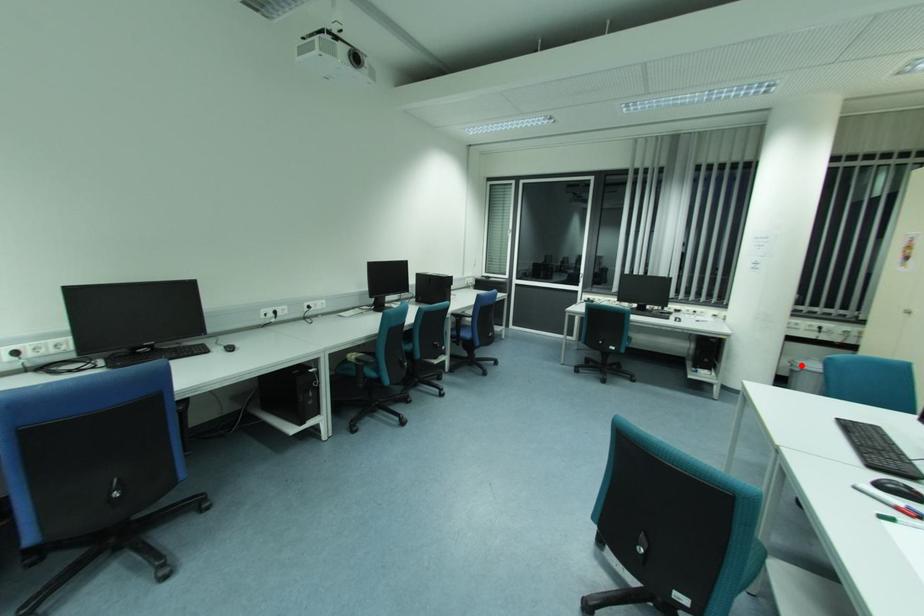
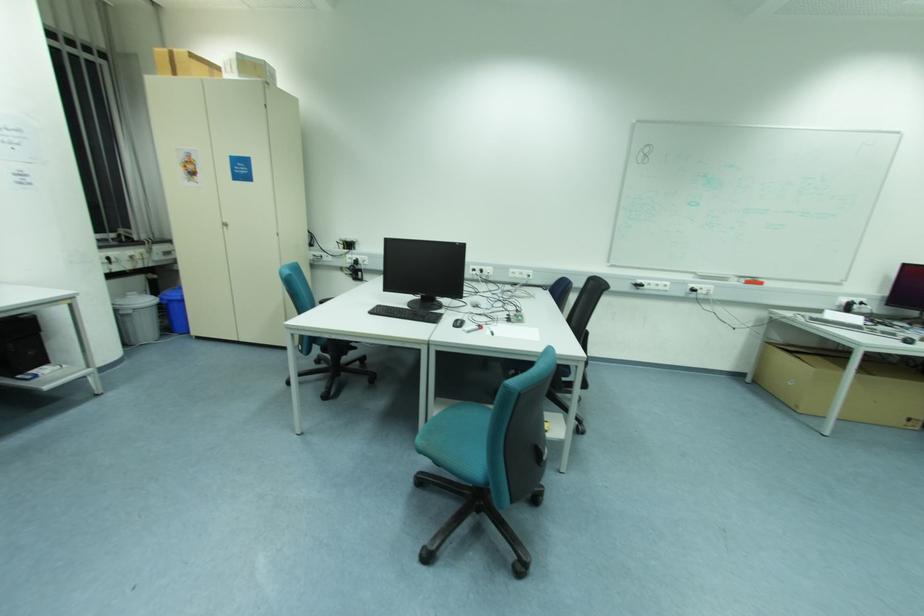
Where in the second image is the point corresponding to the highlighted location from the first image?

(130, 305)